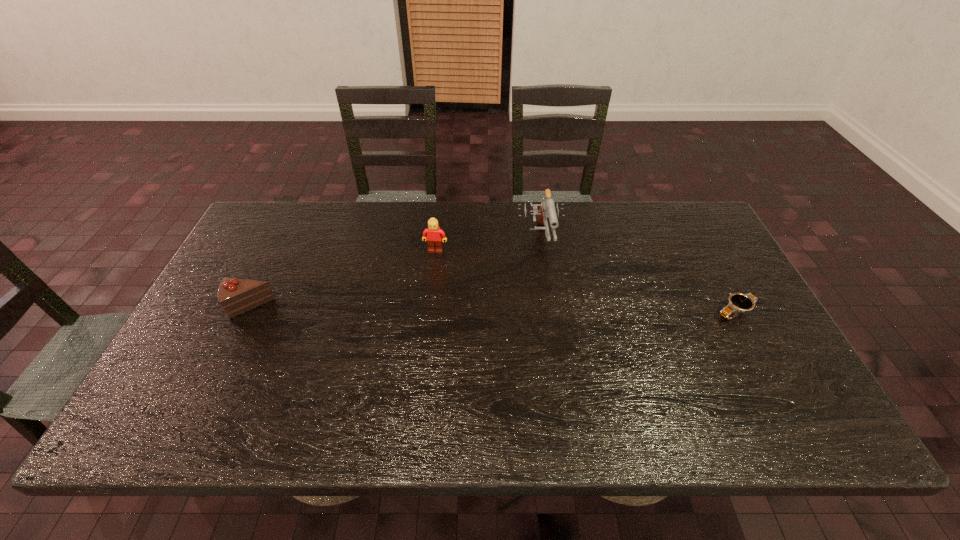
Find the location of a particular element. The image size is (960, 540). the leftmost object is located at coordinates (236, 296).

The image size is (960, 540). In order to click on chocolate cake in this screenshot , I will do `click(236, 296)`.

Where is `watch`? watch is located at coordinates (737, 303).

Identify the location of the shortest object. Image resolution: width=960 pixels, height=540 pixels. (737, 303).

Locate an element on the screen. This screenshot has width=960, height=540. the second object from left to right is located at coordinates (435, 237).

Identify the location of Lego. The image size is (960, 540). (435, 237).

Where is `the third object from left to right`? the third object from left to right is located at coordinates (547, 208).

Where is `gun`? gun is located at coordinates (547, 208).

The height and width of the screenshot is (540, 960). In order to click on free space located on the back of the chocolate cake in this screenshot , I will do `click(287, 230)`.

This screenshot has width=960, height=540. What are the coordinates of `free location located 0.050m on the back of the watch` in the screenshot? It's located at (722, 288).